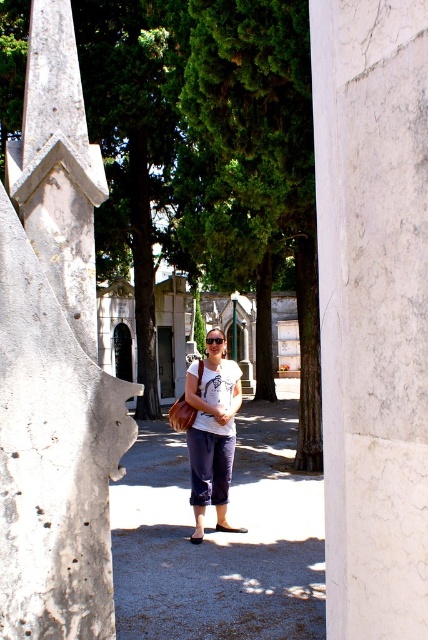
Which is below, white marble pillar at center or denim pants at center?

denim pants at center is below.

Who is more distant from viewer, (348, 342) or (178, 449)?

Positioned behind is point (178, 449).

Identify the location of white marble pillar at center. Image resolution: width=428 pixels, height=640 pixels. (372, 310).

Can you confirm if white marble pillar at center is wider than white cotton t-shirt at center?

In fact, white marble pillar at center might be narrower than white cotton t-shirt at center.

Does point (382, 310) come in front of point (219, 440)?

That is True.

Describe the element at coordinates (372, 310) in the screenshot. I see `white marble pillar at center` at that location.

Locate an element on the screen. The image size is (428, 640). white marble pillar at center is located at coordinates (372, 310).

Can you confirm if denim pants at center is positioned below white cotton t-shirt at center?

Correct, denim pants at center is located below white cotton t-shirt at center.

Which is in front, point (202, 625) or point (226, 468)?

Point (202, 625) is in front.

Is point (142, 636) farther from camera compared to point (208, 449)?

No, it is in front of (208, 449).

Locate an element on the screen. This screenshot has width=428, height=640. denim pants at center is located at coordinates (219, 540).